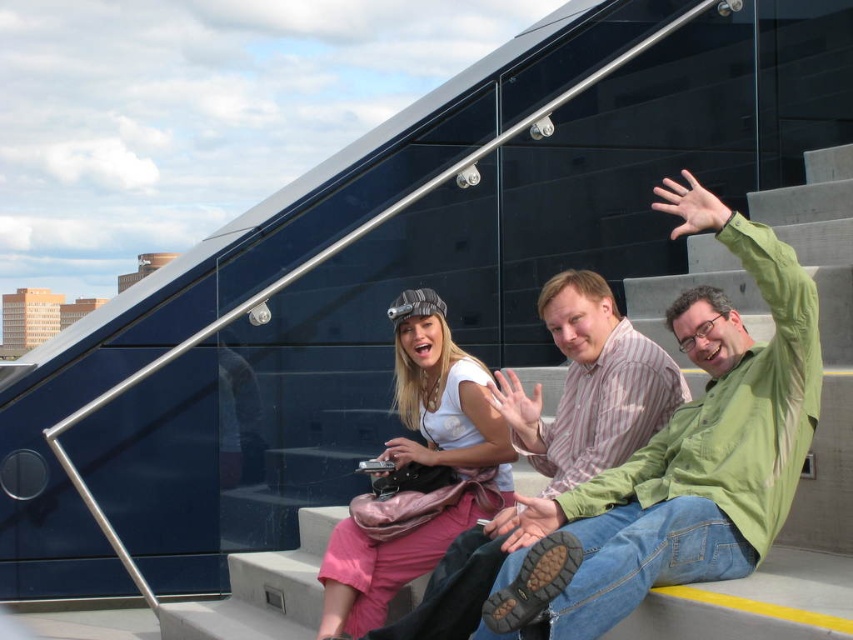
Question: Can you confirm if green cotton shirt at center is positioned above striped cotton shirt at center?

Choices:
 (A) no
 (B) yes

Answer: (B)

Question: Where is white matte shirt at center located in relation to striped cotton shirt at center in the image?

Choices:
 (A) above
 (B) below

Answer: (B)

Question: Is white matte shirt at center wider than striped cotton shirt at center?

Choices:
 (A) yes
 (B) no

Answer: (B)

Question: Considering the real-world distances, which object is farthest from the white matte shirt at center?

Choices:
 (A) striped cotton shirt at center
 (B) green cotton shirt at center

Answer: (B)

Question: Which object is the farthest from the green cotton shirt at center?

Choices:
 (A) white matte shirt at center
 (B) striped cotton shirt at center

Answer: (A)

Question: Which of the following is the farthest from the observer?

Choices:
 (A) (403, 561)
 (B) (672, 404)

Answer: (B)